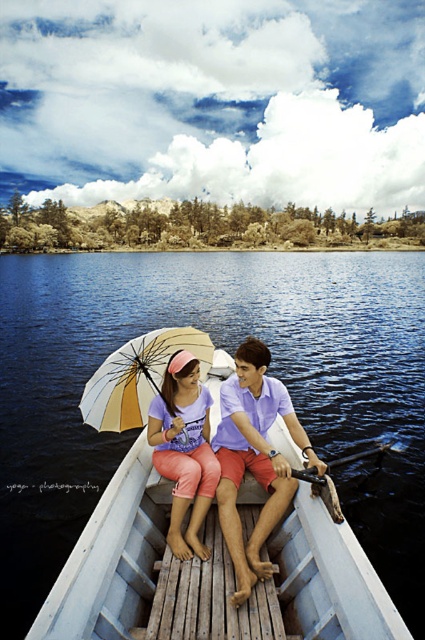
Locate an element on the screen. The image size is (425, 640). matte purple shirt at center is located at coordinates (254, 458).

Is the position of matte purple shirt at center less distant than that of yellow and white striped umbrella at center?

That is True.

Find the location of a particular element. Image resolution: width=425 pixels, height=640 pixels. matte purple shirt at center is located at coordinates (254, 458).

Image resolution: width=425 pixels, height=640 pixels. I want to click on matte purple shirt at center, so click(x=254, y=458).

Between blue water at center and matte purple shirt at center, which one has less height?

matte purple shirt at center

Can you confirm if blue water at center is positioned above matte purple shirt at center?

Yes.

You are a GUI agent. You are given a task and a screenshot of the screen. Output one action in this format:
    pyautogui.click(x=<x>, y=<y>)
    Task: Click on the blue water at center
    The width and height of the screenshot is (425, 640).
    Given the screenshot: What is the action you would take?
    pyautogui.click(x=229, y=353)

Does matte pink shorts at center appear over yellow and white striped umbrella at center?

Incorrect, matte pink shorts at center is not positioned above yellow and white striped umbrella at center.

Who is more distant from viewer, [192,484] or [130,406]?

Positioned behind is point [130,406].

Is point (183, 410) less distant than point (203, 378)?

Yes, point (183, 410) is in front of point (203, 378).

This screenshot has width=425, height=640. I want to click on matte pink shorts at center, so click(184, 449).